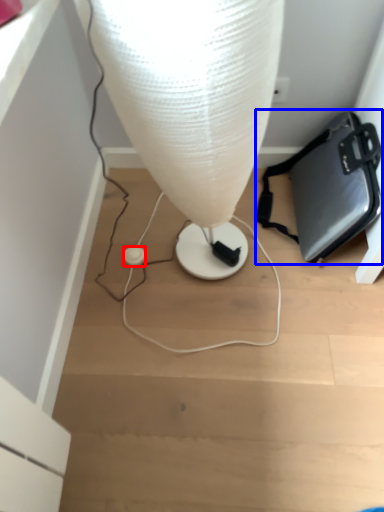
Question: Which object is closer to the camera taking this photo, earphone (highlighted by a red box) or handbag (highlighted by a blue box)?

Choices:
 (A) earphone
 (B) handbag

Answer: (B)